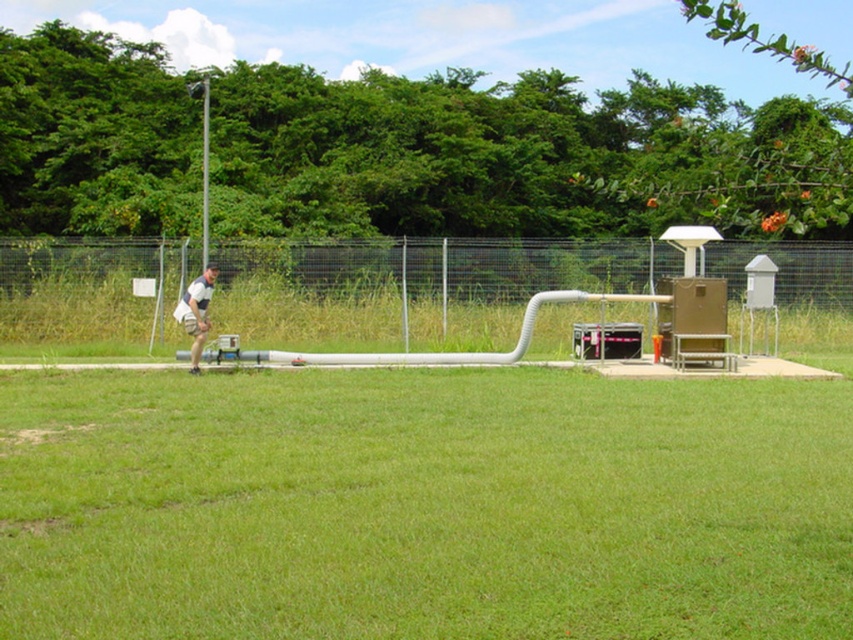
Question: Which of the following is the closest to the observer?

Choices:
 (A) (503, 337)
 (B) (57, 586)
 (C) (196, 369)

Answer: (B)

Question: Is green grass at center wider than metallic wire mesh fence at center?

Choices:
 (A) yes
 (B) no

Answer: (B)

Question: Which object is the farthest from the white matte shorts at center?

Choices:
 (A) metallic wire mesh fence at center
 (B) green grass at center

Answer: (A)

Question: Does metallic wire mesh fence at center have a lesser width compared to white matte shorts at center?

Choices:
 (A) yes
 (B) no

Answer: (B)

Question: Is green grass at center above white matte shorts at center?

Choices:
 (A) yes
 (B) no

Answer: (B)

Question: Which object is farther from the camera taking this photo?

Choices:
 (A) white matte shorts at center
 (B) green grass at center
 (C) metallic wire mesh fence at center

Answer: (C)